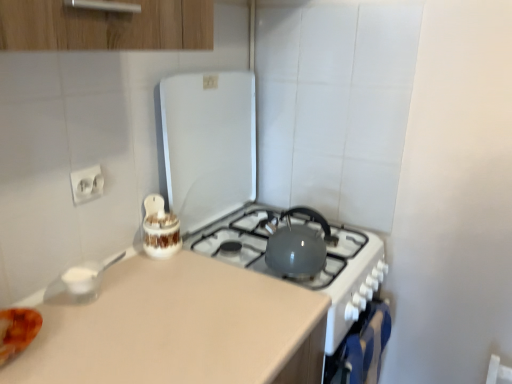
Question: Is matte gray kettle at center, placed as the second appliance when sorted from left to right, inside or outside of blue fabric oven at lower right?

Choices:
 (A) outside
 (B) inside

Answer: (A)

Question: Is matte gray kettle at center, acting as the first appliance starting from the right, wider or thinner than blue fabric oven at lower right?

Choices:
 (A) thin
 (B) wide

Answer: (B)

Question: Estimate the real-world distances between objects in this image. Which object is farther from the white glossy electric outlet at upper left?

Choices:
 (A) white glossy jar at center, arranged as the first appliance when viewed from the left
 (B) matte gray kettle at center, acting as the first appliance starting from the right
 (C) blue fabric oven at lower right

Answer: (C)

Question: Estimate the real-world distances between objects in this image. Which object is farther from the white glossy jar at center, arranged as the first appliance when viewed from the left?

Choices:
 (A) matte gray kettle at center, acting as the first appliance starting from the right
 (B) blue fabric oven at lower right
 (C) white glossy electric outlet at upper left

Answer: (B)